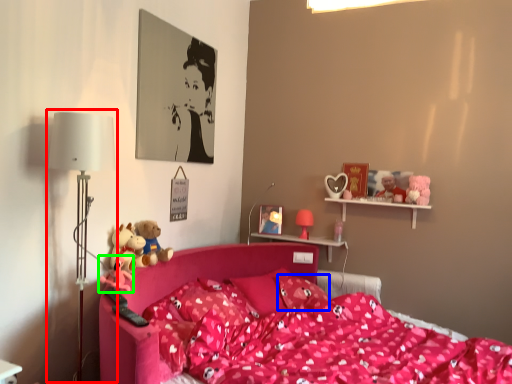
Question: Which object is the closest to the table lamp (highlighted by a red box)? Choose among these: pillow (highlighted by a blue box) or toy (highlighted by a green box).

Choices:
 (A) pillow
 (B) toy

Answer: (B)